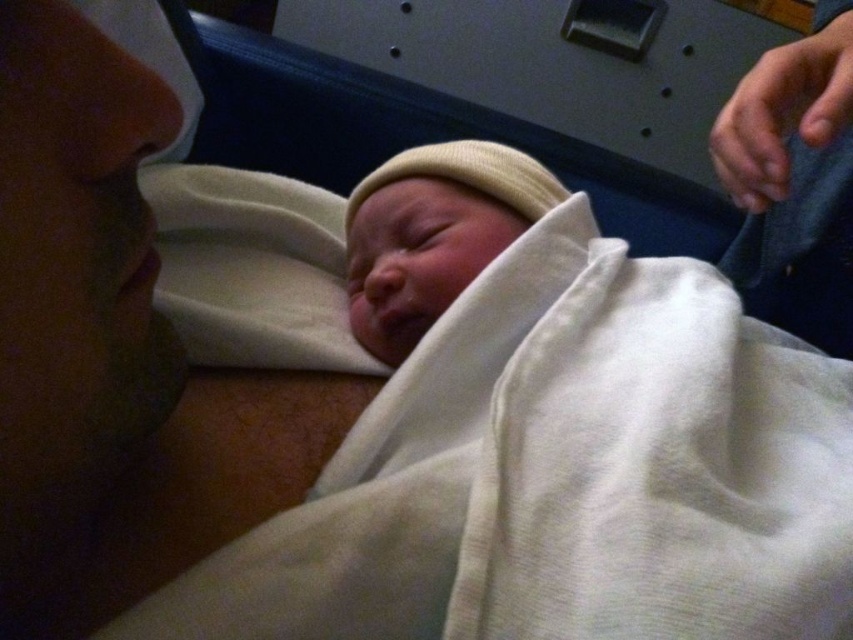
Question: Is smooth skin face at left thinner than white knit cap at center?

Choices:
 (A) no
 (B) yes

Answer: (B)

Question: Which point is farther from the camera taking this photo?

Choices:
 (A) (502, 145)
 (B) (45, 330)

Answer: (A)

Question: Is smooth skin face at left thinner than white knit cap at center?

Choices:
 (A) no
 (B) yes

Answer: (B)

Question: Is smooth skin face at left positioned before white knit cap at center?

Choices:
 (A) yes
 (B) no

Answer: (A)

Question: Which point appears farthest from the camera in this image?

Choices:
 (A) (180, 509)
 (B) (397, 202)

Answer: (B)